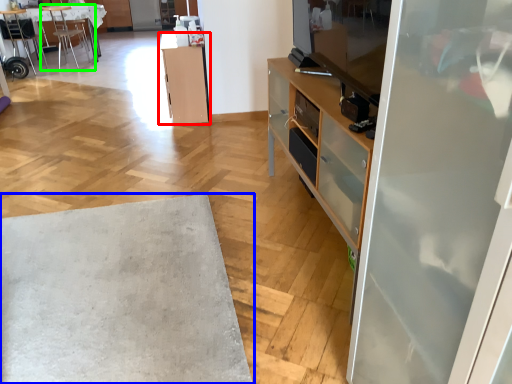
Question: Which object is the farthest from cabinetry (highlighted by a red box)? Choose among these: table (highlighted by a blue box) or chair (highlighted by a green box).

Choices:
 (A) table
 (B) chair

Answer: (B)